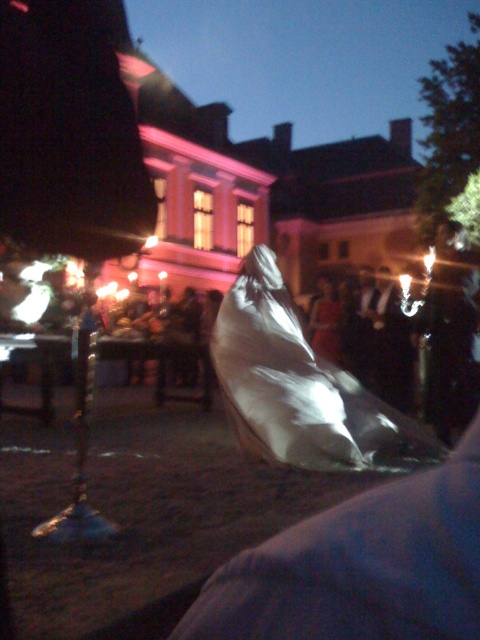
You are standing in the courtyard and want to take a photo of the point at coordinates (229, 342). The camera you are using has a minimum focus distance of 6 meters. Will the camera be able to focus on the point?

The point at coordinates (229, 342) is 5.91 meters from the camera. Since the minimum focus distance is 6 meters, the camera cannot focus on the point because it is too close.

You are standing in the courtyard and want to move from point A to point B. Point A is at coordinates point (322,403) and point B is at point (312,320). Which point is closer to you when you start at point A?

Point A at (322,403) is closer to you than point B at (312,320) because the description states that point (322,403) is closer to the viewer.

You are an event organizer setting up decorations for a party. You have a shiny metallic foil at center and a silky white fabric at center. Based on the scene description, which object is placed below the other?

The shiny metallic foil at center is positioned under the silky white fabric at center according to the description.